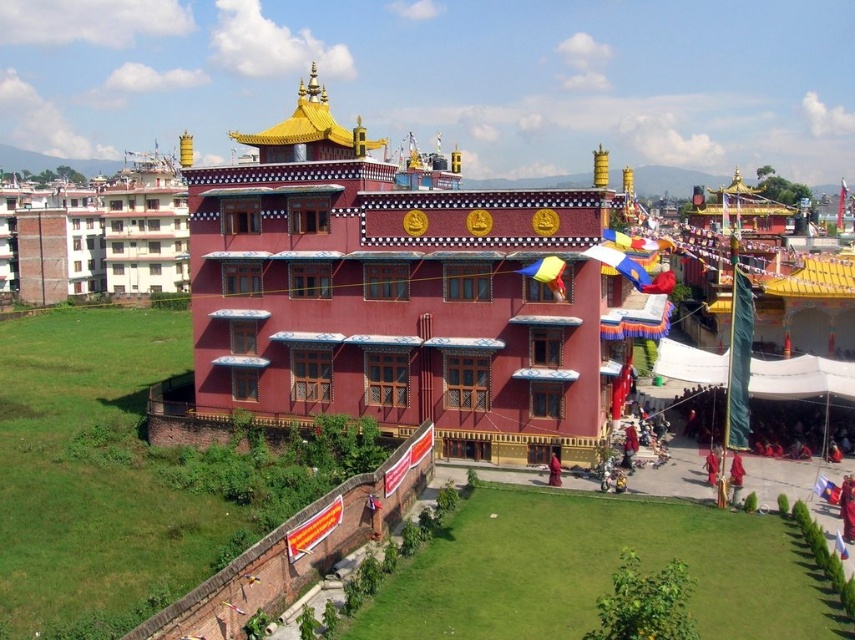
Looking at this image, you are standing in the scene and want to take a photo of the golden fabric robe at lower right without the matte red building at center blocking the view. Is this possible?

The matte red building at center is in front of the golden fabric robe at lower right, so it will block the view. You need to move to a position where the building is not between you and the robe to take the photo.